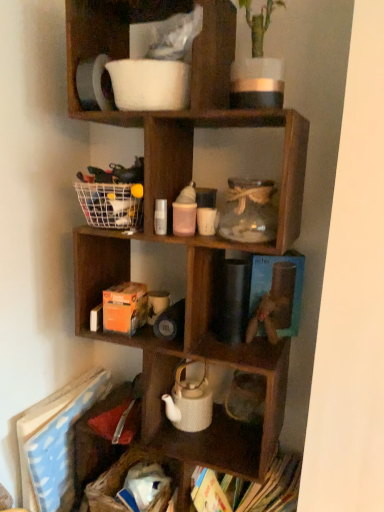
Question: Considering the relative sizes of white matte pitcher at upper center, which is the second shelf in bottom-to-top order, and wooden toy at center in the image provided, is white matte pitcher at upper center, which is the second shelf in bottom-to-top order, taller than wooden toy at center?

Choices:
 (A) no
 (B) yes

Answer: (A)

Question: Could wooden toy at center be considered to be inside white matte pitcher at upper center, which is the second shelf in bottom-to-top order?

Choices:
 (A) yes
 (B) no

Answer: (B)

Question: Is white matte pitcher at upper center, which is the second shelf in bottom-to-top order, not within wooden toy at center?

Choices:
 (A) no
 (B) yes

Answer: (B)

Question: Does white matte pitcher at upper center, which is the second shelf in bottom-to-top order, appear on the left side of wooden toy at center?

Choices:
 (A) yes
 (B) no

Answer: (A)

Question: Does white matte pitcher at upper center, placed as the first shelf when sorted from top to bottom, have a lesser height compared to wooden toy at center?

Choices:
 (A) no
 (B) yes

Answer: (B)

Question: Would you say white matte pitcher at upper center, placed as the first shelf when sorted from top to bottom, is to the left or to the right of blue paper book at lower left, which is the second book from right to left, in the picture?

Choices:
 (A) left
 (B) right

Answer: (B)

Question: From the image's perspective, is white matte pitcher at upper center, placed as the first shelf when sorted from top to bottom, positioned above or below blue paper book at lower left, which is counted as the 1th book, starting from the left?

Choices:
 (A) above
 (B) below

Answer: (A)

Question: Is white matte pitcher at upper center, placed as the first shelf when sorted from top to bottom, wider or thinner than blue paper book at lower left, which is the second book from right to left?

Choices:
 (A) thin
 (B) wide

Answer: (B)

Question: Considering their positions, is white matte pitcher at upper center, which is the second shelf in bottom-to-top order, located in front of or behind blue paper book at lower left, which is counted as the 1th book, starting from the left?

Choices:
 (A) behind
 (B) front

Answer: (B)

Question: From a real-world perspective, is white woven basket at lower left physically located above or below wooden cube at center, acting as the 2th shelf starting from the top?

Choices:
 (A) below
 (B) above

Answer: (A)

Question: Considering the positions of white woven basket at lower left and wooden cube at center, acting as the 2th shelf starting from the top, in the image, is white woven basket at lower left wider or thinner than wooden cube at center, acting as the 2th shelf starting from the top,?

Choices:
 (A) thin
 (B) wide

Answer: (A)

Question: In the image, is white woven basket at lower left positioned in front of or behind wooden cube at center, acting as the 2th shelf starting from the top?

Choices:
 (A) front
 (B) behind

Answer: (B)

Question: From the image's perspective, relative to wooden cube at center, placed as the first shelf when sorted from bottom to top, is white woven basket at lower left above or below?

Choices:
 (A) above
 (B) below

Answer: (B)

Question: Is point (187, 415) closer or farther from the camera than point (31, 435)?

Choices:
 (A) farther
 (B) closer

Answer: (A)

Question: From a real-world perspective, relative to blue paper book at lower left, which is the second book from right to left, is white textured teapot at center vertically above or below?

Choices:
 (A) above
 (B) below

Answer: (A)